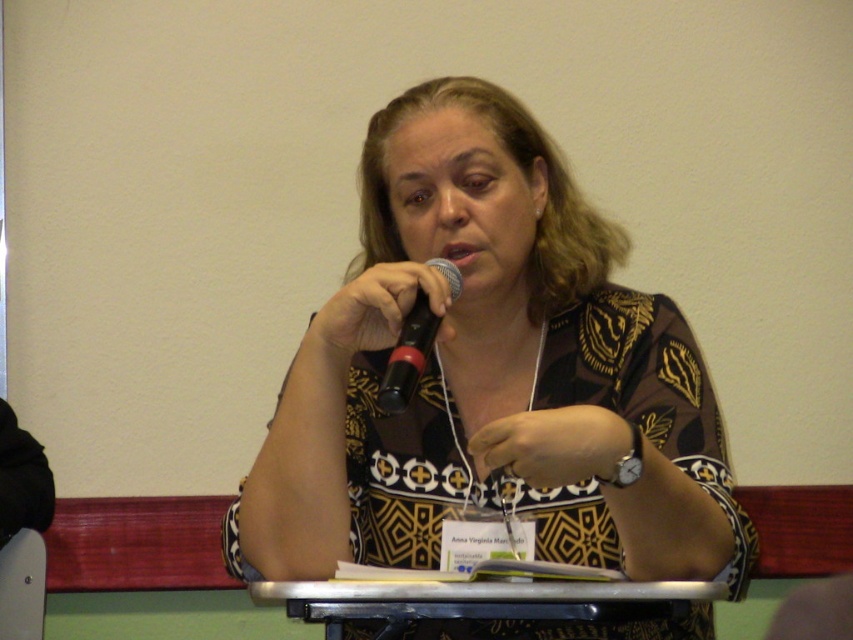
You are attending a conference and see the woman in the image. She is wearing a brown printed blouse at center and sitting at a metallic silver table at center. Which object is positioned to the left from your perspective?

The brown printed blouse at center is to the left of the metallic silver table at center.

You are attending a virtual conference and need to identify the speaker based on the visual cues provided. Which object is positioned higher on the speaker, the brown printed blouse at center or the black matte microphone at center?

The black matte microphone at center is positioned higher than the brown printed blouse at center.